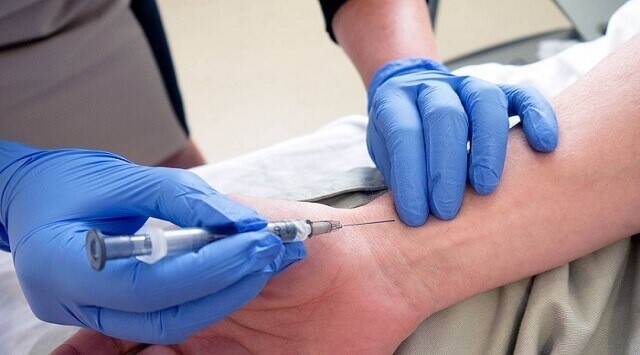
Image resolution: width=640 pixels, height=355 pixels. I want to click on white sheet, so click(x=280, y=153).